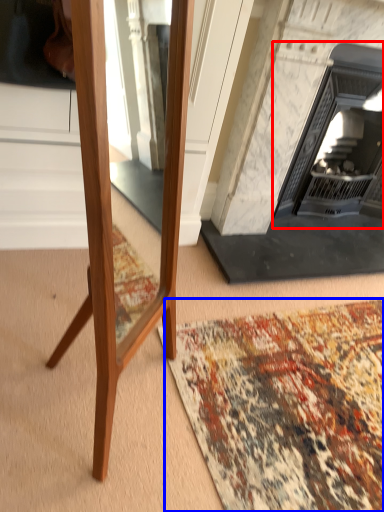
Question: Which object is closer to the camera taking this photo, fireplace (highlighted by a red box) or mat (highlighted by a blue box)?

Choices:
 (A) fireplace
 (B) mat

Answer: (B)